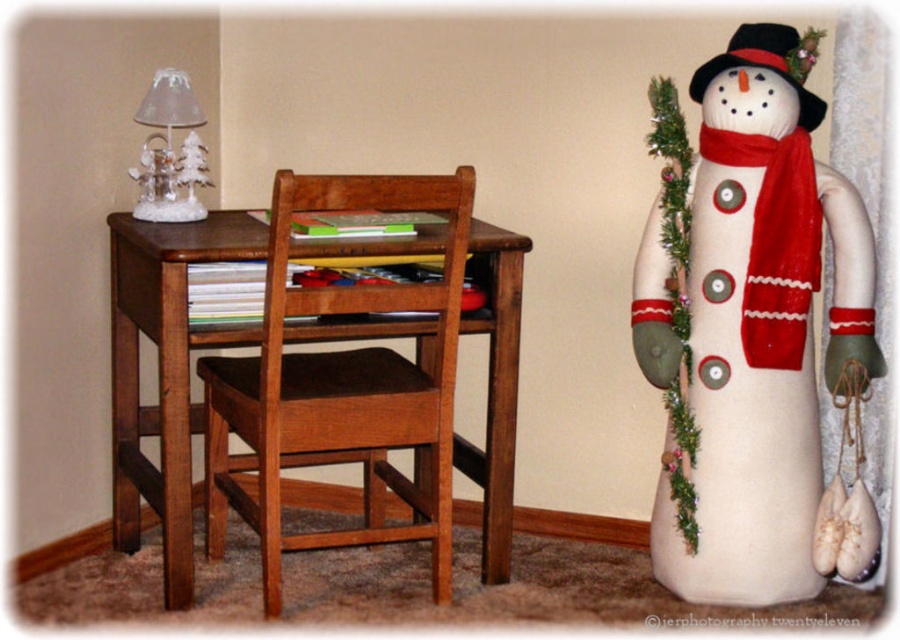
Is point (819, 122) behind point (167, 140)?

No.

Between felt snowman at right and clear glass lampshade at upper left, which one has more height?

Standing taller between the two is felt snowman at right.

The image size is (900, 640). Identify the location of felt snowman at right. (757, 337).

Who is more forward, [258,401] or [796,173]?

Positioned in front is point [258,401].

Which is below, wooden chair at center or red knitted scarf at right?

wooden chair at center is lower down.

The image size is (900, 640). Find the location of `wooden chair at center`. wooden chair at center is located at coordinates (342, 385).

Who is positioned more to the right, felt snowman at right or red knitted scarf at right?

From the viewer's perspective, red knitted scarf at right appears more on the right side.

The height and width of the screenshot is (640, 900). In order to click on felt snowman at right in this screenshot , I will do `click(757, 337)`.

Locate an element on the screen. This screenshot has width=900, height=640. felt snowman at right is located at coordinates (757, 337).